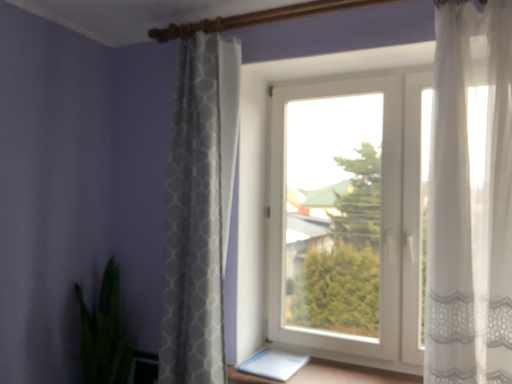
Question: Considering the positions of white plastic window at center and green leafy plant at lower left in the image, is white plastic window at center bigger or smaller than green leafy plant at lower left?

Choices:
 (A) small
 (B) big

Answer: (B)

Question: In the image, is white plastic window at center positioned in front of or behind green leafy plant at lower left?

Choices:
 (A) front
 (B) behind

Answer: (A)

Question: Which is farther from the green leafy plant at lower left?

Choices:
 (A) white textured curtain at center, which is the second curtain in right-to-left order
 (B) sheer white curtain at right, which ranks as the 2th curtain in left-to-right order
 (C) white plastic window at center

Answer: (B)

Question: Which is nearer to the green leafy plant at lower left?

Choices:
 (A) white textured curtain at center, which ranks as the first curtain in back-to-front order
 (B) sheer white curtain at right, which ranks as the 2th curtain in left-to-right order
 (C) white plastic window at center

Answer: (A)